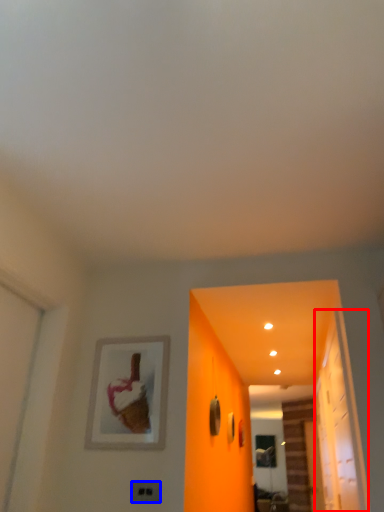
Question: Among these objects, which one is nearest to the camera, glass door (highlighted by a red box) or electric outlet (highlighted by a blue box)?

Choices:
 (A) glass door
 (B) electric outlet

Answer: (A)